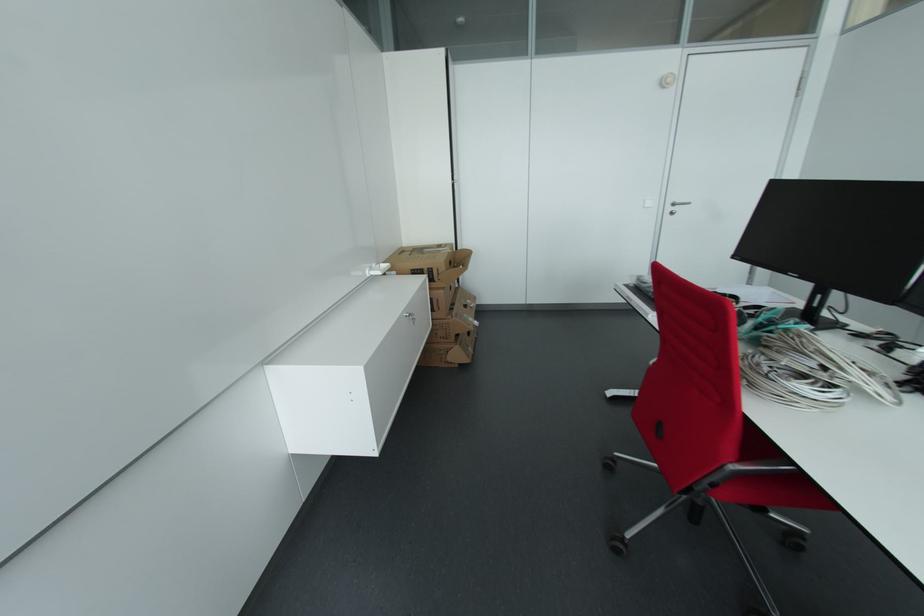
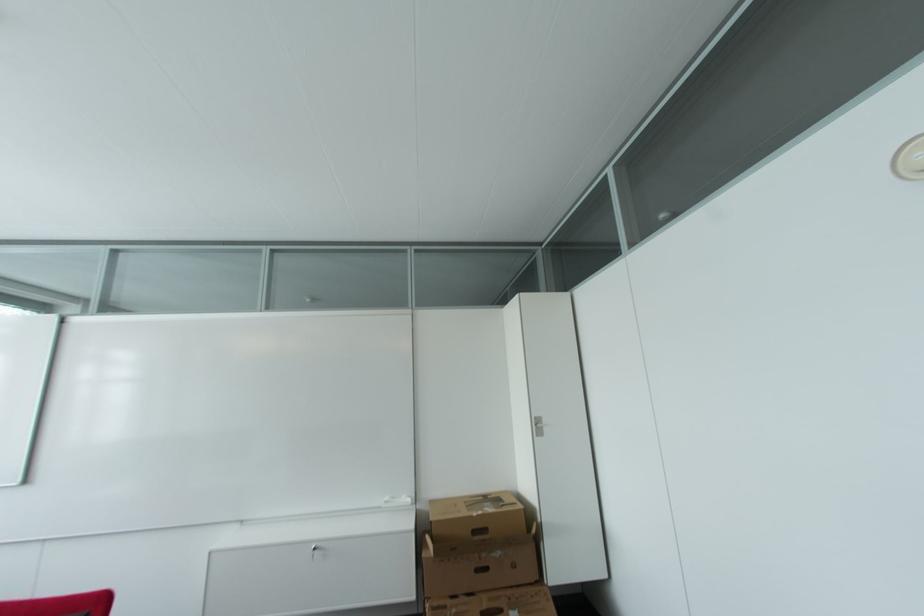
Locate, in the second image, the point that corresponds to point (459, 315) in the first image.

(448, 609)